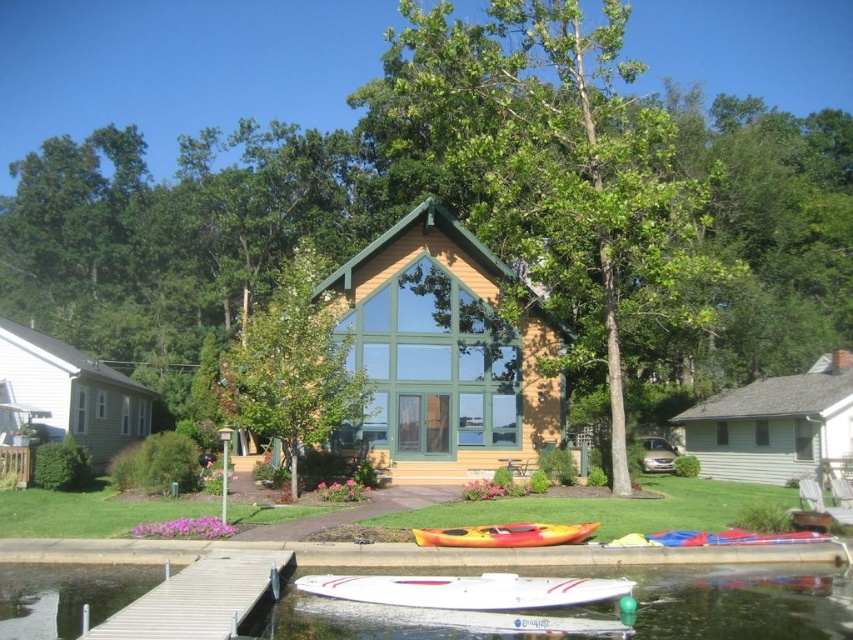
Question: Does white siding cabin at left appear on the left side of yellow matte kayak at lower center?

Choices:
 (A) yes
 (B) no

Answer: (A)

Question: Among these objects, which one is nearest to the camera?

Choices:
 (A) white glossy boat at lower center
 (B) white siding cabin at left

Answer: (A)

Question: Which object is farther from the camera taking this photo?

Choices:
 (A) white glossy boat at lower center
 (B) white wood dock at lower left
 (C) white siding cabin at left
 (D) gray siding house at lower right

Answer: (D)

Question: Is white wood dock at lower left to the left of white glossy boat at lower center from the viewer's perspective?

Choices:
 (A) no
 (B) yes

Answer: (B)

Question: Which object appears closest to the camera in this image?

Choices:
 (A) white wood dock at lower left
 (B) white siding cabin at left
 (C) yellow matte kayak at lower center
 (D) white glossy boat at lower center

Answer: (A)

Question: Does wooden cabin at center have a lesser width compared to yellow matte kayak at lower center?

Choices:
 (A) no
 (B) yes

Answer: (A)